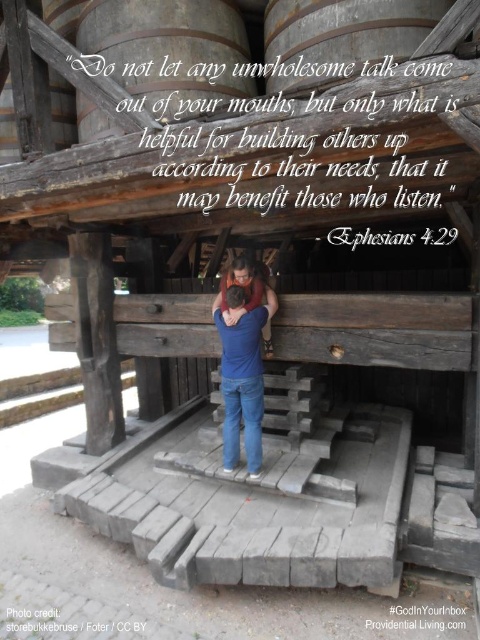
Question: Which object is positioned closest to the blue denim jeans at center?

Choices:
 (A) smooth wooden barrel at upper center
 (B) blue jeans at center
 (C) smooth wooden barrel at upper left

Answer: (B)

Question: Is smooth wooden barrel at upper left bigger than blue denim jeans at center?

Choices:
 (A) yes
 (B) no

Answer: (B)

Question: Can you confirm if blue jeans at center is wider than smooth wooden barrel at upper left?

Choices:
 (A) no
 (B) yes

Answer: (B)

Question: Considering the real-world distances, which object is closest to the smooth wooden barrel at upper left?

Choices:
 (A) wooden barrel at center
 (B) smooth wooden barrel at upper center
 (C) blue jeans at center

Answer: (A)

Question: Among these objects, which one is farthest from the camera?

Choices:
 (A) blue denim jeans at center
 (B) smooth wooden barrel at upper center
 (C) smooth wooden barrel at upper left

Answer: (C)

Question: Does smooth wooden barrel at upper center have a larger size compared to blue jeans at center?

Choices:
 (A) no
 (B) yes

Answer: (B)